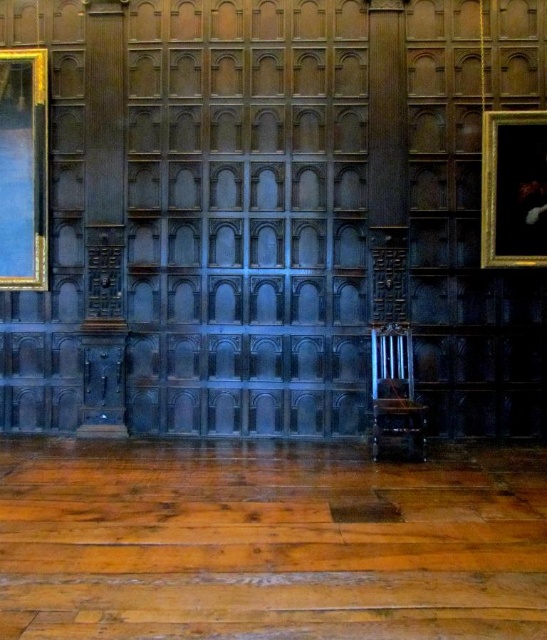
Question: Based on their relative distances, which object is nearer to the gold gilded picture frame at left?

Choices:
 (A) polished dark wood chair at center
 (B) gold-framed portrait at right

Answer: (A)

Question: Does gold gilded picture frame at left appear over polished dark wood chair at center?

Choices:
 (A) no
 (B) yes

Answer: (B)

Question: Which object is the farthest from the gold-framed portrait at right?

Choices:
 (A) polished dark wood chair at center
 (B) gold gilded picture frame at left

Answer: (B)

Question: Does gold gilded picture frame at left have a larger size compared to gold-framed portrait at right?

Choices:
 (A) no
 (B) yes

Answer: (A)

Question: Is gold gilded picture frame at left smaller than gold-framed portrait at right?

Choices:
 (A) yes
 (B) no

Answer: (A)

Question: Which object is farther from the camera taking this photo?

Choices:
 (A) gold-framed portrait at right
 (B) polished dark wood chair at center

Answer: (A)